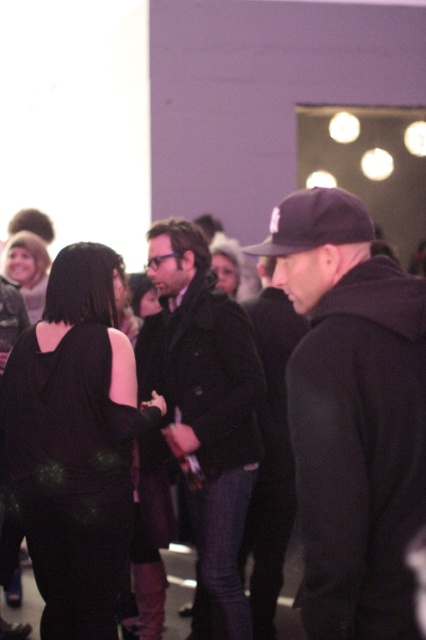
You are at the center of the room and want to place a small gift on the floor near the black fabric baseball cap at center. Can you estimate the coordinates where you should place it?

The black fabric baseball cap at center is located at point (x=314, y=221), so you should place the gift near those coordinates.